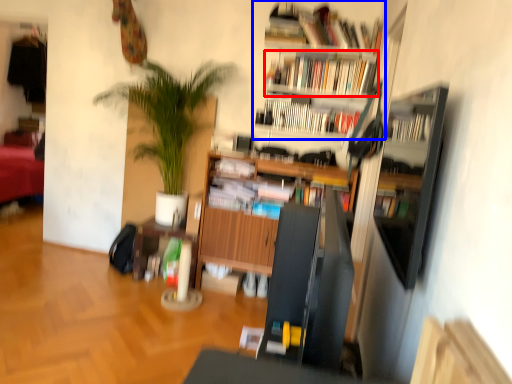
Question: Among these objects, which one is nearest to the camera, book (highlighted by a red box) or bookcase (highlighted by a blue box)?

Choices:
 (A) book
 (B) bookcase

Answer: (B)